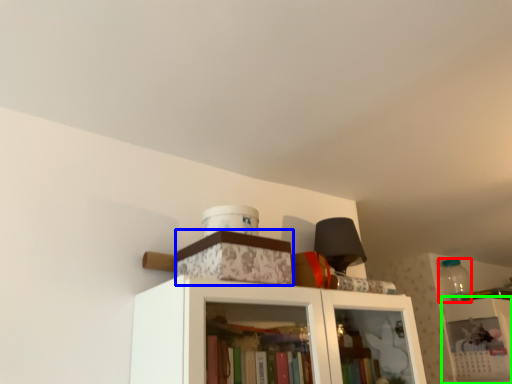
Question: Which object is the closest to the bottle (highlighted by a red box)? Choose among these: cabinetry (highlighted by a blue box) or shelf (highlighted by a green box).

Choices:
 (A) cabinetry
 (B) shelf

Answer: (B)